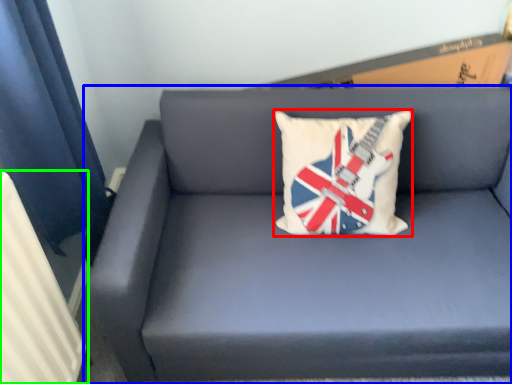
Question: Estimate the real-world distances between objects in this image. Which object is closer to pillow (highlighted by a red box), studio couch (highlighted by a blue box) or radiator (highlighted by a green box)?

Choices:
 (A) studio couch
 (B) radiator

Answer: (A)